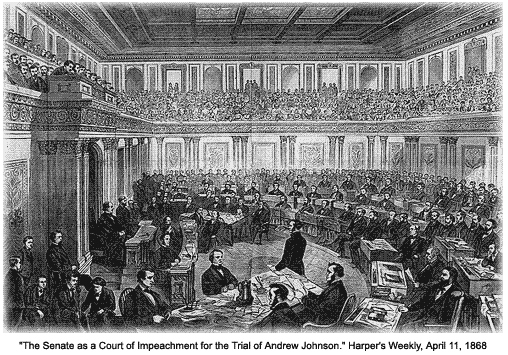
Identify the location of table. This screenshot has height=355, width=508. (317, 292).